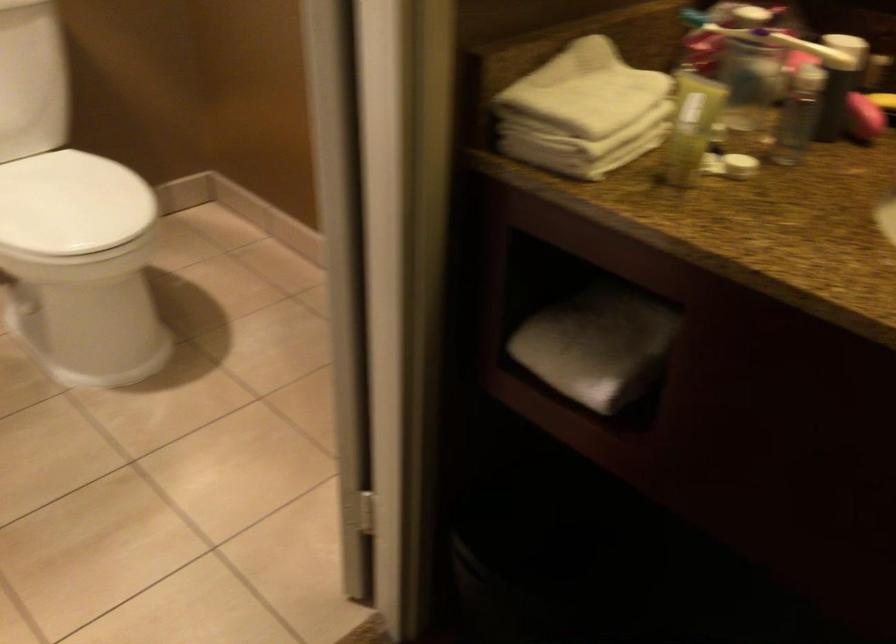
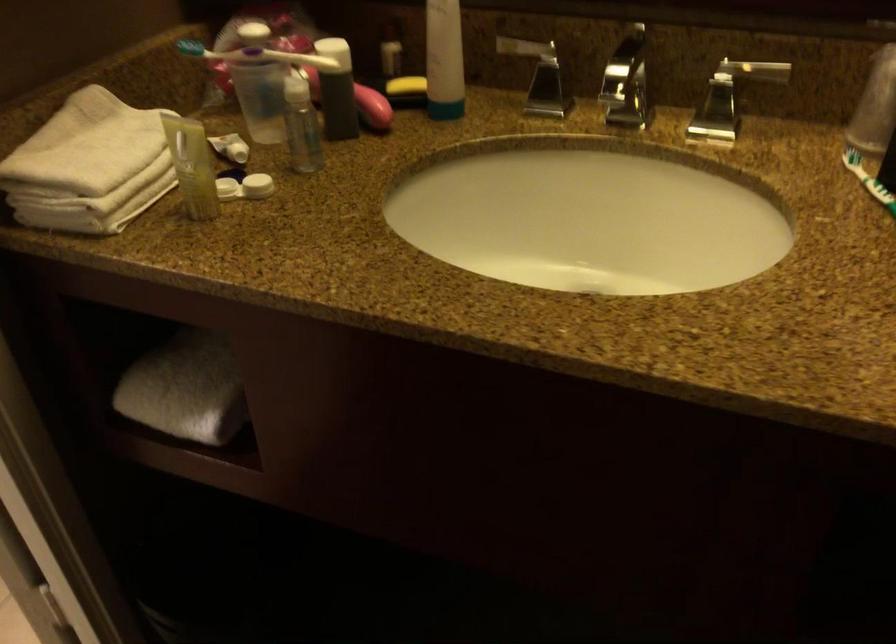
In the second image, find the point that corresponds to (x=588, y=351) in the first image.

(185, 389)